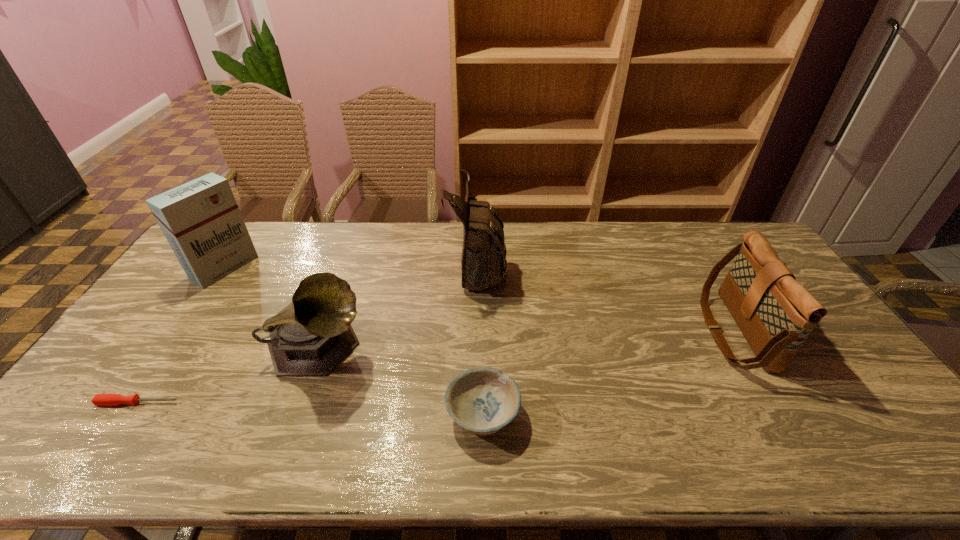
The width and height of the screenshot is (960, 540). What are the coordinates of `free spot located on the horn direction of the third object from left to right` in the screenshot? It's located at (489, 349).

At what (x,y) coordinates should I click in order to perform the action: click on vacant position located 0.120m on the front-facing side of the right shoulder bag. Please return your answer as a coordinate pair (x, y). This screenshot has width=960, height=540. Looking at the image, I should click on (666, 332).

This screenshot has height=540, width=960. Identify the location of free location located on the front-facing side of the right shoulder bag. (666, 332).

What are the coordinates of `vacant space positioned 0.140m on the front-facing side of the right shoulder bag` in the screenshot? It's located at (660, 332).

Where is `free space located 0.360m on the right of the second shortest object`? The height and width of the screenshot is (540, 960). free space located 0.360m on the right of the second shortest object is located at coordinates (667, 414).

I want to click on free location located 0.400m at the tip of the screwdriver, so click(339, 403).

At what (x,y) coordinates should I click in order to perform the action: click on shoulder bag that is at the far edge. Please return your answer as a coordinate pair (x, y). Looking at the image, I should click on (483, 261).

The height and width of the screenshot is (540, 960). I want to click on cigarette case present at the far edge, so click(200, 219).

At what (x,y) coordinates should I click in order to perform the action: click on object present at the near edge. Please return your answer as a coordinate pair (x, y). Image resolution: width=960 pixels, height=540 pixels. Looking at the image, I should click on (482, 400).

Where is `cigarette case that is at the left edge`? This screenshot has width=960, height=540. cigarette case that is at the left edge is located at coordinates (200, 219).